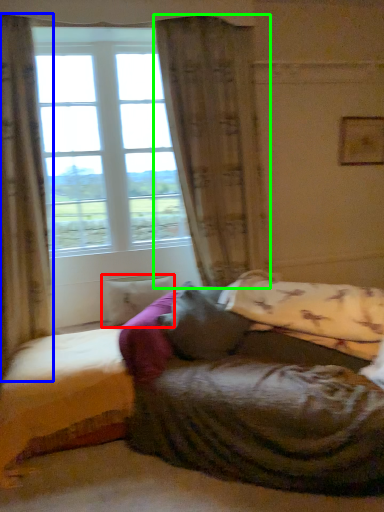
Question: Considering the real-world distances, which object is closest to pillow (highlighted by a red box)? curtain (highlighted by a blue box) or curtain (highlighted by a green box).

Choices:
 (A) curtain
 (B) curtain

Answer: (A)